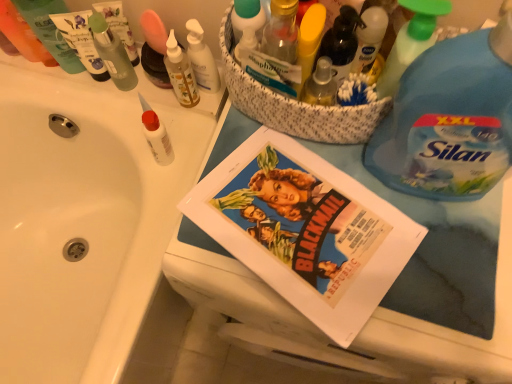
Identify the location of unoccupied area in front of matte green tube at upper left, which is the third toiletry in left-to-right order. (104, 111).